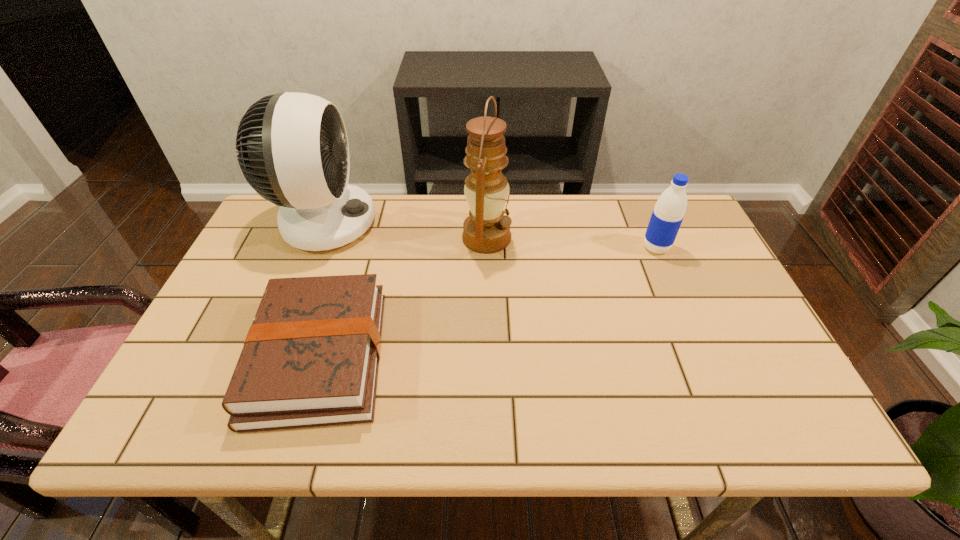
The width and height of the screenshot is (960, 540). I want to click on oil lamp, so click(x=486, y=230).

Where is `fan`? Image resolution: width=960 pixels, height=540 pixels. fan is located at coordinates (293, 149).

The width and height of the screenshot is (960, 540). Identify the location of water bottle. (668, 213).

This screenshot has width=960, height=540. Find the location of `the third tallest object`. the third tallest object is located at coordinates (668, 213).

The width and height of the screenshot is (960, 540). In order to click on hardback book in this screenshot , I will do `click(310, 358)`.

Identify the location of the shortest object. (310, 358).

Identify the location of vacant position located 0.280m on the left of the third object from left to right. This screenshot has width=960, height=540. (368, 238).

The image size is (960, 540). Identify the location of vacant position located 0.190m on the grille of the fan. (437, 222).

You are a GUI agent. You are given a task and a screenshot of the screen. Output one action in this format:
    pyautogui.click(x=<x>, y=<y>)
    Task: Click on the blank space located on the front of the second shortest object
    This screenshot has width=960, height=540.
    Given the screenshot: What is the action you would take?
    pyautogui.click(x=669, y=280)

This screenshot has height=540, width=960. What are the coordinates of `vacant space located on the back of the nearest object` in the screenshot? It's located at (353, 244).